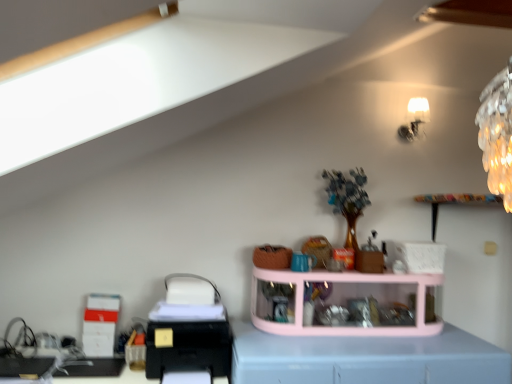
Question: Is black plastic printer at lower left bigger or smaller than white glossy lampshade at upper right?

Choices:
 (A) big
 (B) small

Answer: (A)

Question: In the image, is black plastic printer at lower left on the left side or the right side of white glossy lampshade at upper right?

Choices:
 (A) right
 (B) left

Answer: (B)

Question: Estimate the real-world distances between objects in this image. Which object is closer to the black plastic printer at lower left?

Choices:
 (A) white glossy lampshade at upper right
 (B) light blue plastic at center
 (C) pink plastic shelf at center

Answer: (B)

Question: Which object is the farthest from the light blue plastic at center?

Choices:
 (A) pink plastic shelf at center
 (B) white glossy lampshade at upper right
 (C) black plastic printer at lower left

Answer: (B)